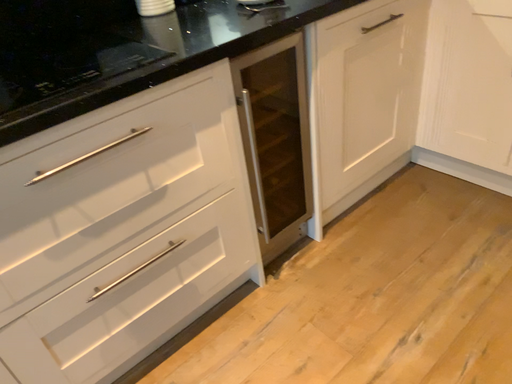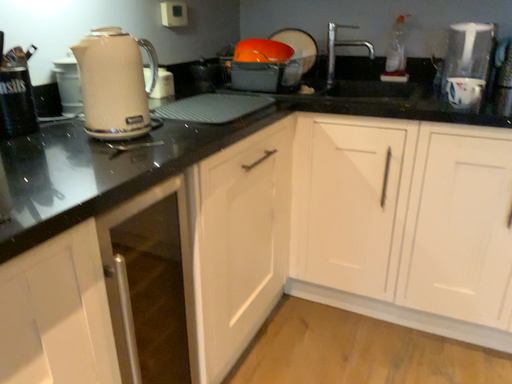
Question: How did the camera likely rotate when shooting the video?

Choices:
 (A) rotated left
 (B) rotated right

Answer: (B)